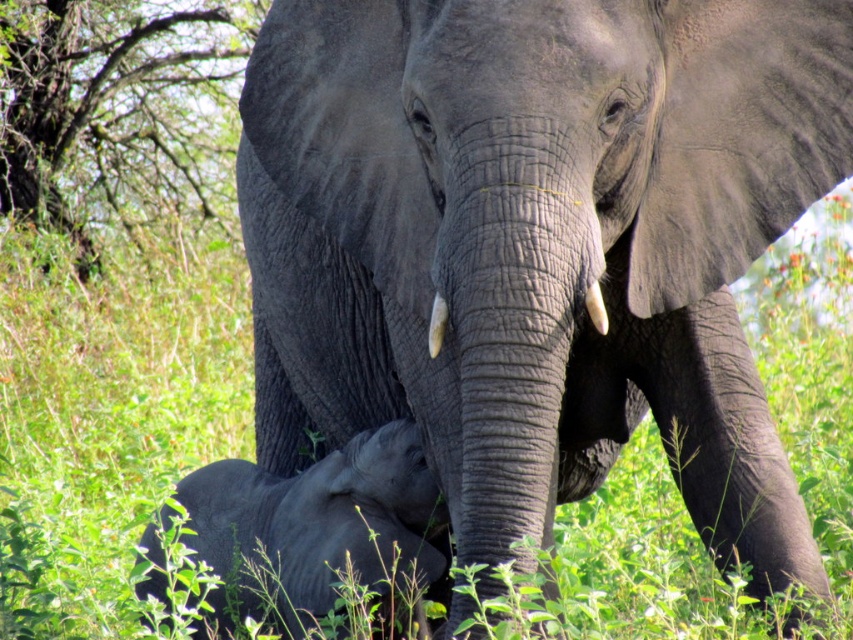
Question: Does gray matte elephant at center have a smaller size compared to white matte tusk at center?

Choices:
 (A) yes
 (B) no

Answer: (B)

Question: From the image, what is the correct spatial relationship of gray matte elephant at center in relation to green leafy tree at upper left?

Choices:
 (A) left
 (B) right

Answer: (B)

Question: Which point is farther to the camera?

Choices:
 (A) (431, 317)
 (B) (595, 326)
 (C) (428, 525)

Answer: (C)

Question: Based on their relative distances, which object is nearer to the white matte tusk at center?

Choices:
 (A) green leafy tree at upper left
 (B) white smooth tusk at center

Answer: (B)

Question: Is green leafy tree at upper left bigger than white matte tusk at center?

Choices:
 (A) yes
 (B) no

Answer: (A)

Question: Which of the following is the closest to the observer?

Choices:
 (A) green leafy tree at upper left
 (B) gray matte elephant at center
 (C) white smooth tusk at center
 (D) gray matte elephant at lower left

Answer: (B)